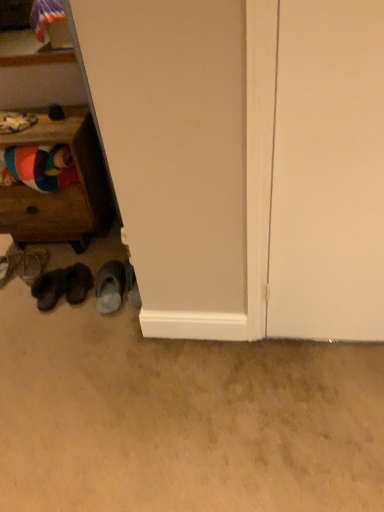
I want to click on leather sandal at lower left, the first footwear viewed from the left, so click(x=9, y=266).

The width and height of the screenshot is (384, 512). What do you see at coordinates (60, 191) in the screenshot?
I see `wooden drawer at left` at bounding box center [60, 191].

Where is `multicolored fabric at left`? multicolored fabric at left is located at coordinates (38, 167).

What do you see at coordinates (32, 263) in the screenshot? I see `leather sandal at lower left, the 4th footwear positioned from the right` at bounding box center [32, 263].

This screenshot has width=384, height=512. In order to click on leather sandal at lower left, the 4th footwear positioned from the right in this screenshot , I will do `click(32, 263)`.

Measure the distance between white matte door at right and camera.

white matte door at right is 35.30 inches from camera.

The height and width of the screenshot is (512, 384). What are the coordinates of `leather sandal at lower left, the first footwear viewed from the left` in the screenshot? It's located at (9, 266).

From a real-world perspective, is wooden drawer at left above or below multicolored fabric at left?

wooden drawer at left is below multicolored fabric at left.

Would you say wooden drawer at left is outside multicolored fabric at left?

Yes, wooden drawer at left is not within multicolored fabric at left.

Can you confirm if wooden drawer at left is bigger than multicolored fabric at left?

Indeed, wooden drawer at left has a larger size compared to multicolored fabric at left.

Which object is positioned more to the left, wooden drawer at left or multicolored fabric at left?

Positioned to the left is wooden drawer at left.

Is point (33, 258) more distant than point (50, 274)?

Yes, point (33, 258) is farther from viewer.

Could you tell me if leather sandal at lower left, which is counted as the 2th footwear, starting from the left, is turned towards dark gray suede slippers at lower left, which is the 3th footwear in left-to-right order?

No.

Are leather sandal at lower left, which is counted as the 2th footwear, starting from the left, and dark gray suede slippers at lower left, the 3th footwear when ordered from right to left, making contact?

No, leather sandal at lower left, which is counted as the 2th footwear, starting from the left, is not with dark gray suede slippers at lower left, the 3th footwear when ordered from right to left.

Based on the photo, between leather sandal at lower left, which is counted as the 2th footwear, starting from the left, and dark gray suede slippers at lower left, the 3th footwear when ordered from right to left, which one has larger width?

With larger width is dark gray suede slippers at lower left, the 3th footwear when ordered from right to left.

Can we say leather sandal at lower left, which is the fifth footwear from right to left, lies outside brown suede shoes at lower left, the fourth footwear positioned from the left?

Yes, leather sandal at lower left, which is the fifth footwear from right to left, is located beyond the bounds of brown suede shoes at lower left, the fourth footwear positioned from the left.

Measure the distance from leather sandal at lower left, the first footwear viewed from the left, to brown suede shoes at lower left, arranged as the 2th footwear when viewed from the right.

A distance of 14.63 inches exists between leather sandal at lower left, the first footwear viewed from the left, and brown suede shoes at lower left, arranged as the 2th footwear when viewed from the right.

Can you tell me how much leather sandal at lower left, the first footwear viewed from the left, and brown suede shoes at lower left, the fourth footwear positioned from the left, differ in facing direction?

The facing directions of leather sandal at lower left, the first footwear viewed from the left, and brown suede shoes at lower left, the fourth footwear positioned from the left, are 6.32 degrees apart.

Can you confirm if leather sandal at lower left, which is the fifth footwear from right to left, is shorter than brown suede shoes at lower left, arranged as the 2th footwear when viewed from the right?

Correct, leather sandal at lower left, which is the fifth footwear from right to left, is not as tall as brown suede shoes at lower left, arranged as the 2th footwear when viewed from the right.

Considering the relative sizes of leather sandal at lower left, which is the fifth footwear from right to left, and leather sandal at lower left, which is counted as the 2th footwear, starting from the left, in the image provided, is leather sandal at lower left, which is the fifth footwear from right to left, shorter than leather sandal at lower left, which is counted as the 2th footwear, starting from the left,?

In fact, leather sandal at lower left, which is the fifth footwear from right to left, may be taller than leather sandal at lower left, which is counted as the 2th footwear, starting from the left.

Does leather sandal at lower left, the first footwear viewed from the left, appear on the right side of leather sandal at lower left, which is counted as the 2th footwear, starting from the left?

No, leather sandal at lower left, the first footwear viewed from the left, is not to the right of leather sandal at lower left, which is counted as the 2th footwear, starting from the left.

Is leather sandal at lower left, which is the fifth footwear from right to left, oriented away from leather sandal at lower left, which is counted as the 2th footwear, starting from the left?

No, leather sandal at lower left, which is the fifth footwear from right to left, is not facing away from leather sandal at lower left, which is counted as the 2th footwear, starting from the left.

How much distance is there between gray fuzzy slippers at lower left, the 5th footwear when ordered from left to right, and dark gray suede slippers at lower left, the 3th footwear when ordered from right to left?

They are 22.13 centimeters apart.

Is gray fuzzy slippers at lower left, the 1th footwear when ordered from right to left, facing towards dark gray suede slippers at lower left, the 3th footwear when ordered from right to left?

No, gray fuzzy slippers at lower left, the 1th footwear when ordered from right to left, is not aimed at dark gray suede slippers at lower left, the 3th footwear when ordered from right to left.

From the image's perspective, which is below, gray fuzzy slippers at lower left, the 1th footwear when ordered from right to left, or dark gray suede slippers at lower left, which is the 3th footwear in left-to-right order?

dark gray suede slippers at lower left, which is the 3th footwear in left-to-right order, from the image's perspective.

Considering the sizes of objects gray fuzzy slippers at lower left, the 5th footwear when ordered from left to right, and dark gray suede slippers at lower left, which is the 3th footwear in left-to-right order, in the image provided, who is thinner, gray fuzzy slippers at lower left, the 5th footwear when ordered from left to right, or dark gray suede slippers at lower left, which is the 3th footwear in left-to-right order,?

With smaller width is dark gray suede slippers at lower left, which is the 3th footwear in left-to-right order.

Choose the correct answer: Is gray fuzzy slippers at lower left, the 5th footwear when ordered from left to right, inside brown suede shoes at lower left, the fourth footwear positioned from the left, or outside it?

gray fuzzy slippers at lower left, the 5th footwear when ordered from left to right, is outside brown suede shoes at lower left, the fourth footwear positioned from the left.

Which object is further away from the camera, gray fuzzy slippers at lower left, the 5th footwear when ordered from left to right, or brown suede shoes at lower left, arranged as the 2th footwear when viewed from the right?

brown suede shoes at lower left, arranged as the 2th footwear when viewed from the right, is further from the camera.

Is gray fuzzy slippers at lower left, the 1th footwear when ordered from right to left, far from brown suede shoes at lower left, the fourth footwear positioned from the left?

No, there isn't a large distance between gray fuzzy slippers at lower left, the 1th footwear when ordered from right to left, and brown suede shoes at lower left, the fourth footwear positioned from the left.

From the image's perspective, which is below, dark gray suede slippers at lower left, which is the 3th footwear in left-to-right order, or multicolored fabric at left?

dark gray suede slippers at lower left, which is the 3th footwear in left-to-right order, is shown below in the image.

Is dark gray suede slippers at lower left, the 3th footwear when ordered from right to left, facing away from multicolored fabric at left?

No, dark gray suede slippers at lower left, the 3th footwear when ordered from right to left, is not facing the opposite direction of multicolored fabric at left.

Who is smaller, dark gray suede slippers at lower left, the 3th footwear when ordered from right to left, or multicolored fabric at left?

dark gray suede slippers at lower left, the 3th footwear when ordered from right to left, is smaller.

Where is `clothing on the right of wooden drawer at left`? clothing on the right of wooden drawer at left is located at coordinates (38, 167).

Where is `the 2nd footwear below the dark gray suede slippers at lower left, the 3th footwear when ordered from right to left (from a real-world perspective)`? the 2nd footwear below the dark gray suede slippers at lower left, the 3th footwear when ordered from right to left (from a real-world perspective) is located at coordinates (32, 263).

Which object lies further to the anchor point gray fuzzy slippers at lower left, the 1th footwear when ordered from right to left, multicolored fabric at left or leather sandal at lower left, which is counted as the 2th footwear, starting from the left?

Based on the image, multicolored fabric at left appears to be further to gray fuzzy slippers at lower left, the 1th footwear when ordered from right to left.

Looking at the image, which one is located further to white matte door at right, brown suede shoes at lower left, the fourth footwear positioned from the left, or wooden drawer at left?

wooden drawer at left.

Which object lies further to the anchor point multicolored fabric at left, brown suede shoes at lower left, arranged as the 2th footwear when viewed from the right, or dark gray suede slippers at lower left, the 3th footwear when ordered from right to left?

dark gray suede slippers at lower left, the 3th footwear when ordered from right to left.

Considering their positions, is leather sandal at lower left, the 4th footwear positioned from the right, positioned closer to multicolored fabric at left than dark gray suede slippers at lower left, the 3th footwear when ordered from right to left?

leather sandal at lower left, the 4th footwear positioned from the right, is closer to multicolored fabric at left.

When comparing their distances from wooden drawer at left, does brown suede shoes at lower left, the fourth footwear positioned from the left, or dark gray suede slippers at lower left, which is the 3th footwear in left-to-right order, seem further?

dark gray suede slippers at lower left, which is the 3th footwear in left-to-right order, is further to wooden drawer at left.

From the image, which object appears to be farther from dark gray suede slippers at lower left, the 3th footwear when ordered from right to left, gray fuzzy slippers at lower left, the 5th footwear when ordered from left to right, or multicolored fabric at left?

The object further to dark gray suede slippers at lower left, the 3th footwear when ordered from right to left, is multicolored fabric at left.

From the image, which object appears to be farther from leather sandal at lower left, the first footwear viewed from the left, dark gray suede slippers at lower left, which is the 3th footwear in left-to-right order, or gray fuzzy slippers at lower left, the 1th footwear when ordered from right to left?

gray fuzzy slippers at lower left, the 1th footwear when ordered from right to left, lies further to leather sandal at lower left, the first footwear viewed from the left, than the other object.

Looking at the image, which one is located further to gray fuzzy slippers at lower left, the 5th footwear when ordered from left to right, leather sandal at lower left, which is the fifth footwear from right to left, or leather sandal at lower left, which is counted as the 2th footwear, starting from the left?

leather sandal at lower left, which is the fifth footwear from right to left, lies further to gray fuzzy slippers at lower left, the 5th footwear when ordered from left to right, than the other object.

Where is `cabinetry between leather sandal at lower left, the 4th footwear positioned from the right, and white matte door at right from left to right`? The height and width of the screenshot is (512, 384). cabinetry between leather sandal at lower left, the 4th footwear positioned from the right, and white matte door at right from left to right is located at coordinates (60, 191).

You are a GUI agent. You are given a task and a screenshot of the screen. Output one action in this format:
    pyautogui.click(x=<x>, y=<y>)
    Task: Click on the footwear situated between dark gray suede slippers at lower left, the 3th footwear when ordered from right to left, and gray fuzzy slippers at lower left, the 1th footwear when ordered from right to left, from left to right
    The height and width of the screenshot is (512, 384).
    Given the screenshot: What is the action you would take?
    pyautogui.click(x=77, y=283)

The width and height of the screenshot is (384, 512). In order to click on footwear between wooden drawer at left and leather sandal at lower left, which is the fifth footwear from right to left, in the vertical direction in this screenshot , I will do 32,263.

This screenshot has width=384, height=512. What are the coordinates of `footwear between leather sandal at lower left, which is counted as the 2th footwear, starting from the left, and brown suede shoes at lower left, the fourth footwear positioned from the left, in the horizontal direction` in the screenshot? It's located at (48, 289).